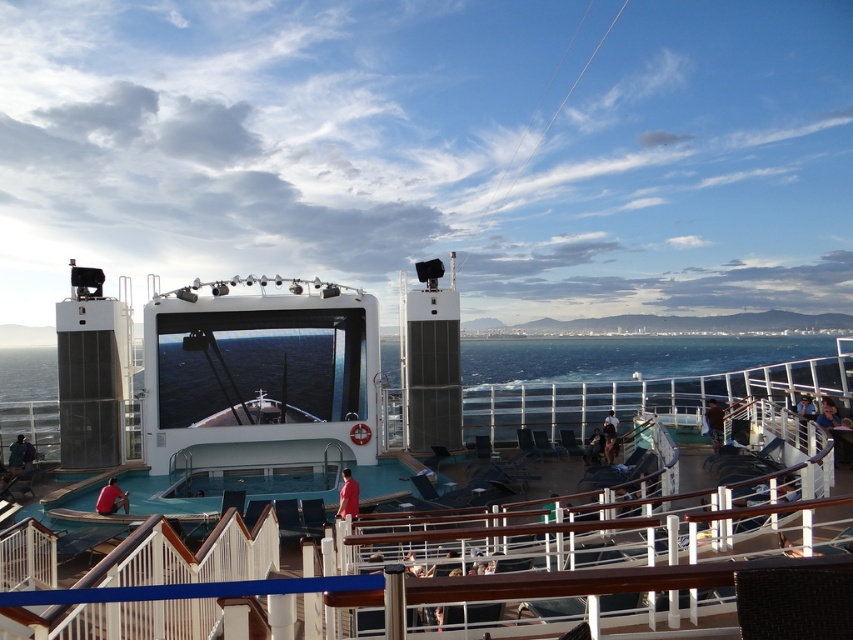
You are standing on the cruise ship deck and see the blue water at center and the red matte shirt at lower center. Which object is positioned to the right of the other?

The blue water at center is to the right of the red matte shirt at lower center.

You are organizing a small event on the cruise ship deck. You have a white glossy stage at center and a dark blue fabric at lower left. Which object has a greater width?

The white glossy stage at center has a greater width than the dark blue fabric at lower left according to the description.